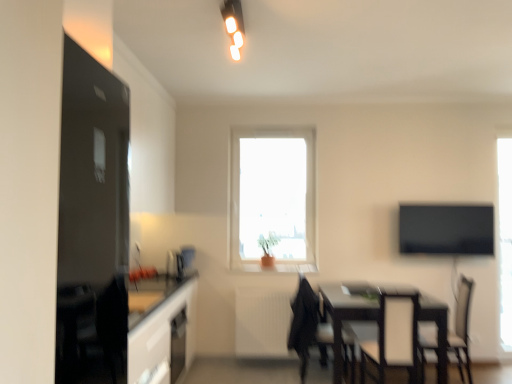
Question: From the image's perspective, is black fabric chair at lower right, the 1th chair positioned from the right, under black leather chair at center, the first chair from the left?

Choices:
 (A) no
 (B) yes

Answer: (B)

Question: Is black fabric chair at lower right, the second chair positioned from the left, shorter than black leather chair at center, the 2th chair from the right?

Choices:
 (A) yes
 (B) no

Answer: (A)

Question: Is black fabric chair at lower right, the 1th chair positioned from the right, at the left side of black leather chair at center, the 2th chair from the right?

Choices:
 (A) no
 (B) yes

Answer: (A)

Question: Does black fabric chair at lower right, the second chair positioned from the left, appear on the right side of black leather chair at center, the 2th chair from the right?

Choices:
 (A) yes
 (B) no

Answer: (A)

Question: Is black fabric chair at lower right, the 1th chair positioned from the right, not near black leather chair at center, the 2th chair from the right?

Choices:
 (A) no
 (B) yes

Answer: (B)

Question: Considering the positions of transparent glass window at right, the second window positioned from the left, and black glossy tv at right in the image, is transparent glass window at right, the second window positioned from the left, bigger or smaller than black glossy tv at right?

Choices:
 (A) big
 (B) small

Answer: (A)

Question: Would you say transparent glass window at right, the second window positioned from the left, is inside or outside black glossy tv at right?

Choices:
 (A) outside
 (B) inside

Answer: (A)

Question: From a real-world perspective, is transparent glass window at right, which is the first window from right to left, above or below black glossy tv at right?

Choices:
 (A) below
 (B) above

Answer: (A)

Question: Is point (507, 173) positioned closer to the camera than point (454, 228)?

Choices:
 (A) farther
 (B) closer

Answer: (A)

Question: Do you think white textured radiator at center is within black leather chair at center, the first chair from the left, or outside of it?

Choices:
 (A) outside
 (B) inside

Answer: (A)

Question: Is point (272, 344) positioned closer to the camera than point (294, 344)?

Choices:
 (A) farther
 (B) closer

Answer: (A)

Question: From their relative heights in the image, would you say white textured radiator at center is taller or shorter than black leather chair at center, the 2th chair from the right?

Choices:
 (A) tall
 (B) short

Answer: (B)

Question: In terms of size, does white textured radiator at center appear bigger or smaller than black leather chair at center, the first chair from the left?

Choices:
 (A) small
 (B) big

Answer: (A)

Question: From the image's perspective, is black glossy tv at right located above or below white glossy light fixture at upper center?

Choices:
 (A) above
 (B) below

Answer: (B)

Question: Do you think black glossy tv at right is within white glossy light fixture at upper center, or outside of it?

Choices:
 (A) outside
 (B) inside

Answer: (A)